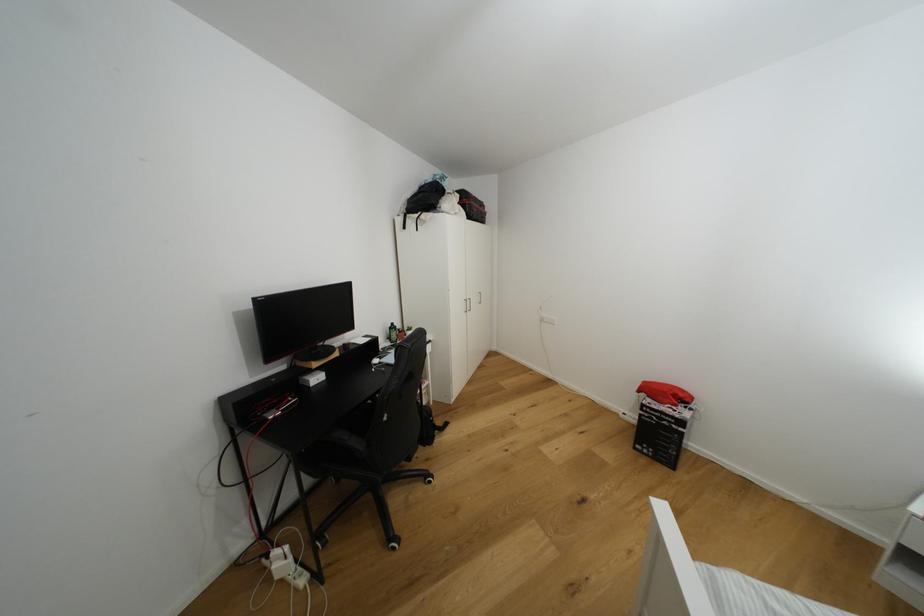
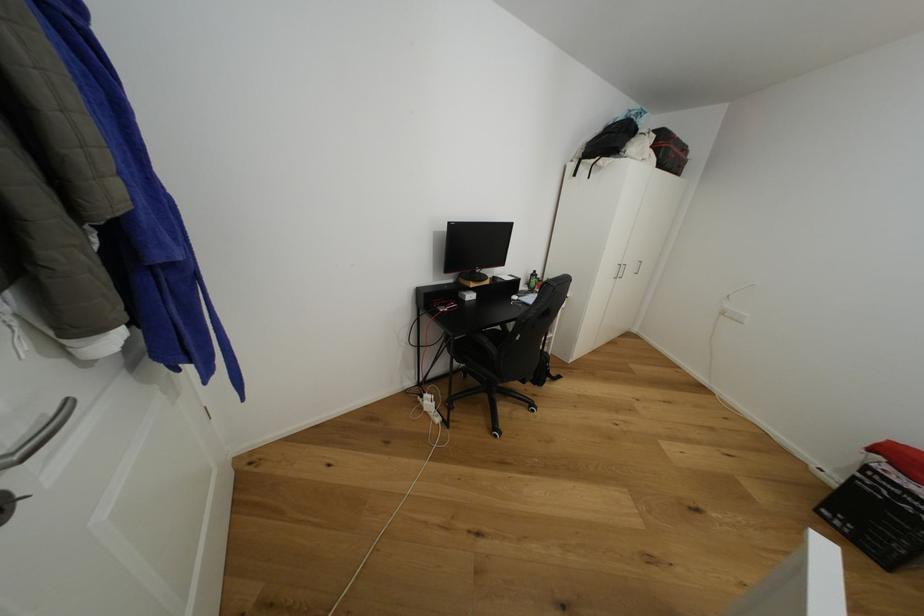
Question: How did the camera likely rotate?

Choices:
 (A) Left
 (B) Right
 (C) Up
 (D) Down

Answer: (A)